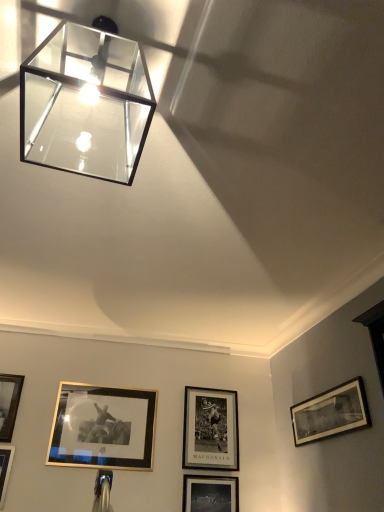
Question: From a real-world perspective, does black matte picture frame at lower right, which is the 1th picture frame from right to left, sit lower than gold-framed picture at lower left, which is the 5th picture frame from right to left?

Choices:
 (A) yes
 (B) no

Answer: (A)

Question: Considering the relative sizes of black matte picture frame at lower right, which is the 1th picture frame from right to left, and gold-framed picture at lower left, which is the 5th picture frame from right to left, in the image provided, is black matte picture frame at lower right, which is the 1th picture frame from right to left, shorter than gold-framed picture at lower left, which is the 5th picture frame from right to left,?

Choices:
 (A) no
 (B) yes

Answer: (B)

Question: Can you confirm if black matte picture frame at lower right, the 5th picture frame in the left-to-right sequence, is thinner than gold-framed picture at lower left, which is the 5th picture frame from right to left?

Choices:
 (A) yes
 (B) no

Answer: (B)

Question: Is black matte picture frame at lower right, which is the 1th picture frame from right to left, to the left of gold-framed picture at lower left, which is the 5th picture frame from right to left, from the viewer's perspective?

Choices:
 (A) no
 (B) yes

Answer: (A)

Question: Considering the relative sizes of black matte picture frame at lower right, which is the 1th picture frame from right to left, and gold-framed picture at lower left, placed as the first picture frame when sorted from left to right, in the image provided, is black matte picture frame at lower right, which is the 1th picture frame from right to left, taller than gold-framed picture at lower left, placed as the first picture frame when sorted from left to right,?

Choices:
 (A) no
 (B) yes

Answer: (A)

Question: Is matte black picture frame at lower center, the third picture frame viewed from the right, inside the boundaries of clear glass cube at upper left, or outside?

Choices:
 (A) outside
 (B) inside

Answer: (A)

Question: Is point (188, 496) positioned closer to the camera than point (43, 105)?

Choices:
 (A) farther
 (B) closer

Answer: (A)

Question: In the image, is matte black picture frame at lower center, the third picture frame viewed from the right, positioned in front of or behind clear glass cube at upper left?

Choices:
 (A) front
 (B) behind

Answer: (B)

Question: From a real-world perspective, is matte black picture frame at lower center, which is counted as the 3th picture frame, starting from the left, above or below clear glass cube at upper left?

Choices:
 (A) above
 (B) below

Answer: (B)

Question: In terms of size, does gold metallic picture frame at lower left, the 2th picture frame in the left-to-right sequence, appear bigger or smaller than black matte picture frame at center, positioned as the fourth picture frame in left-to-right order?

Choices:
 (A) small
 (B) big

Answer: (A)

Question: From the image's perspective, is gold metallic picture frame at lower left, the 2th picture frame in the left-to-right sequence, positioned above or below black matte picture frame at center, placed as the second picture frame when sorted from right to left?

Choices:
 (A) above
 (B) below

Answer: (A)

Question: In terms of width, does gold metallic picture frame at lower left, the 2th picture frame in the left-to-right sequence, look wider or thinner when compared to black matte picture frame at center, placed as the second picture frame when sorted from right to left?

Choices:
 (A) thin
 (B) wide

Answer: (A)

Question: Based on their positions, is gold metallic picture frame at lower left, the 2th picture frame in the left-to-right sequence, located to the left or right of black matte picture frame at center, placed as the second picture frame when sorted from right to left?

Choices:
 (A) right
 (B) left

Answer: (B)

Question: Considering the positions of clear glass cube at upper left and black matte picture frame at lower right, the 5th picture frame in the left-to-right sequence, in the image, is clear glass cube at upper left taller or shorter than black matte picture frame at lower right, the 5th picture frame in the left-to-right sequence,?

Choices:
 (A) short
 (B) tall

Answer: (B)

Question: In the image, is clear glass cube at upper left positioned in front of or behind black matte picture frame at lower right, the 5th picture frame in the left-to-right sequence?

Choices:
 (A) behind
 (B) front

Answer: (B)